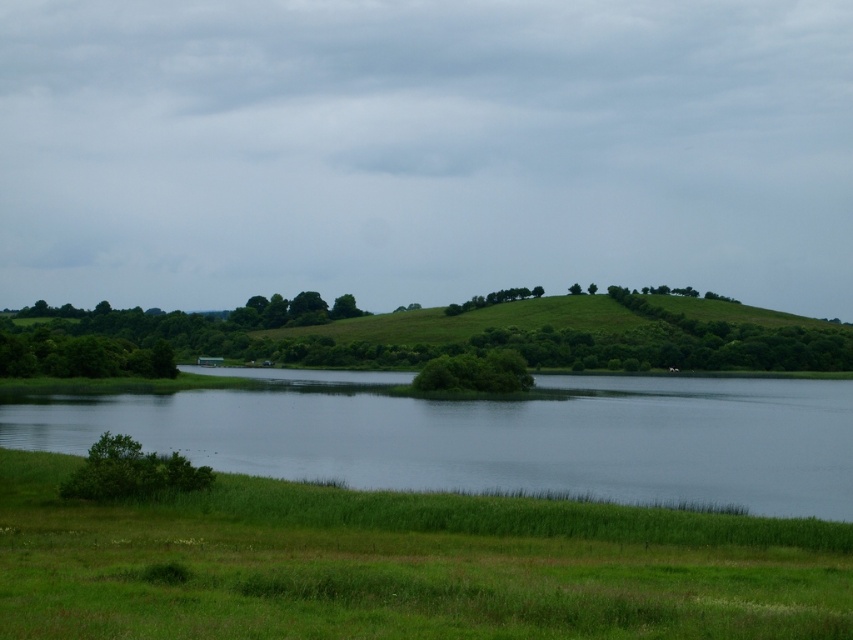
You are standing in the serene landscape and want to place a small flag at each of the two points, point (90, 458) and point (508, 385). Which point will have its flag appear larger in your view?

The flag placed at point (90, 458) will appear larger because it is closer to the camera than point (508, 385).

Looking at this image, you are standing at the center of the image and want to reach the point marked at coordinates point (131, 472). Which direction should you move relative to the green leafy bush at lower left?

The point (131, 472) is located on the green leafy bush at lower left. To reach it, you should move towards the lower left direction from your current position at the center of the image.

You are standing at the edge of the water in the image and want to walk towards the green leafy bush at lower left. Which direction should you move relative to the green grassy at lower center?

The green grassy at lower center is located below the green leafy bush at lower left, so to reach the green leafy bush at lower left, you should move upward from the green grassy at lower center.